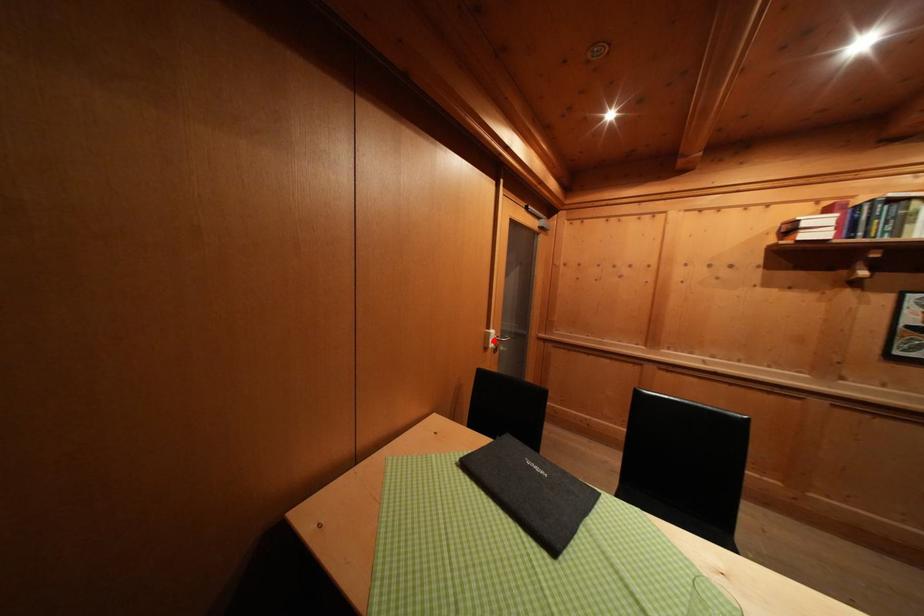
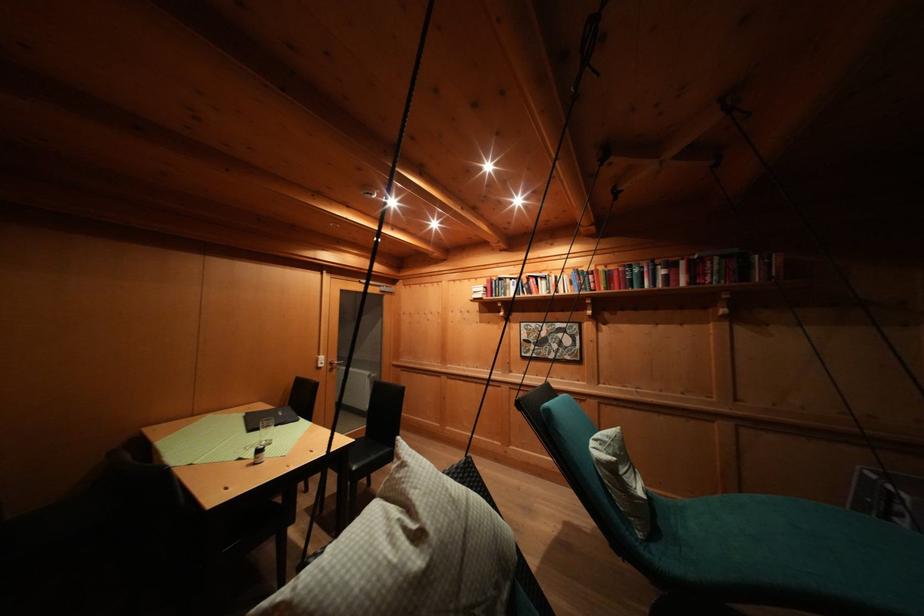
The point at the highlighted location is marked in the first image. Where is the corresponding point in the second image?

(323, 363)